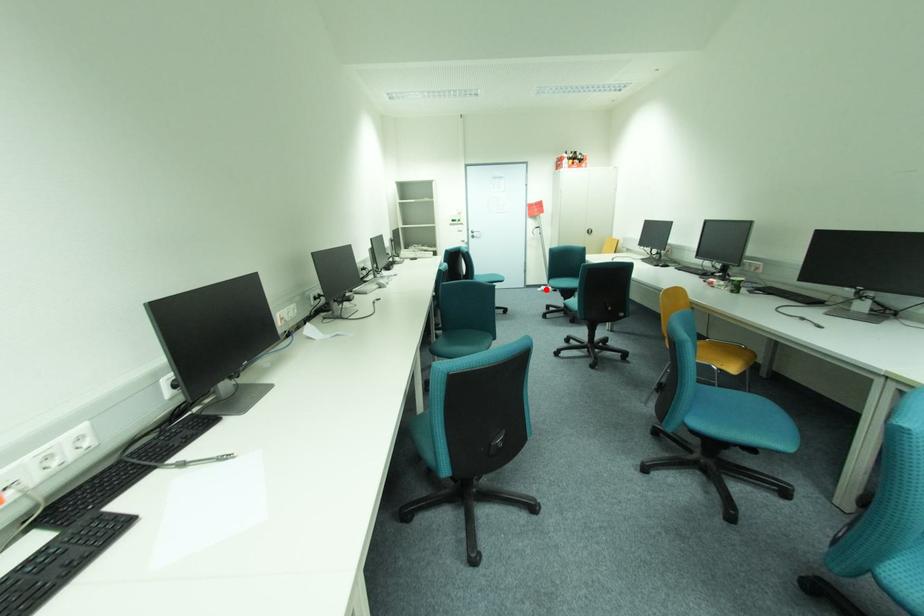
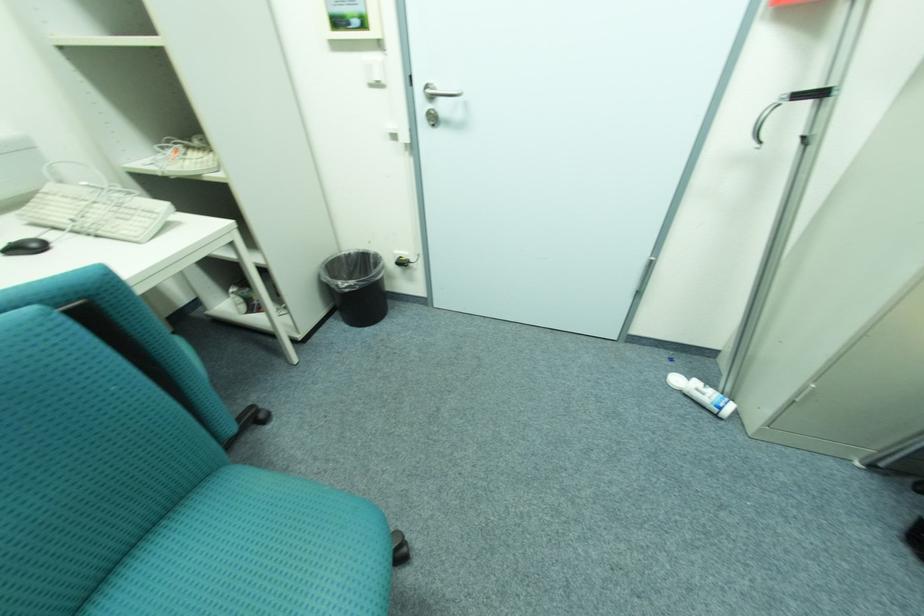
Where in the second image is the point corresponding to the highlighted location from the first image?

(683, 381)